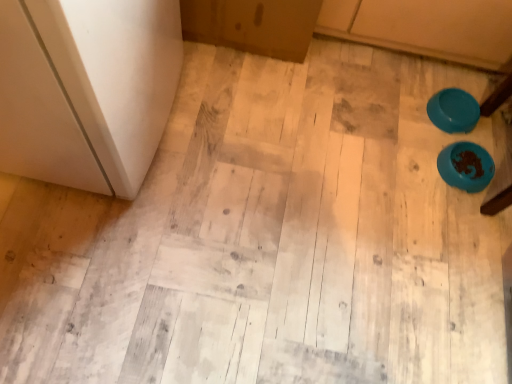
Find the location of a particular element. The height and width of the screenshot is (384, 512). free point to the left of teal glossy bowl at upper right, which is the first bowl from top to bottom is located at coordinates (399, 101).